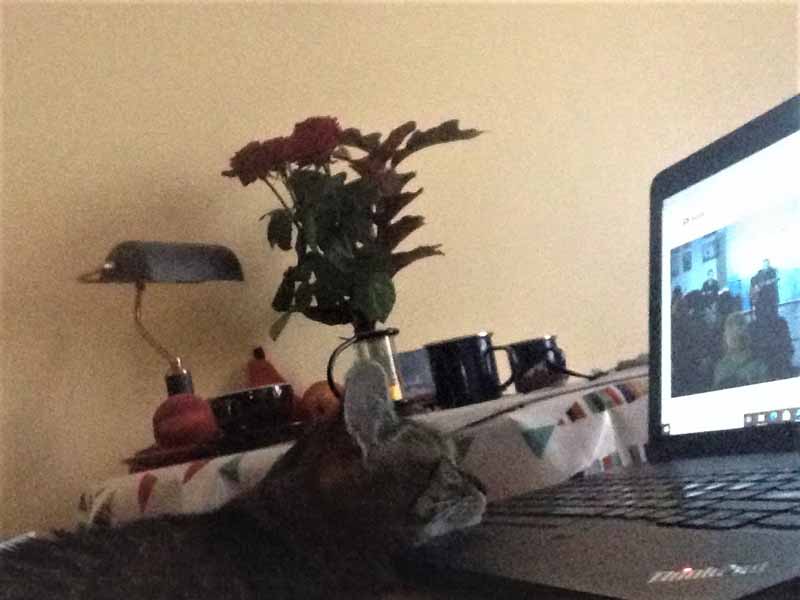
I want to click on screen of the laptop, so click(734, 339).